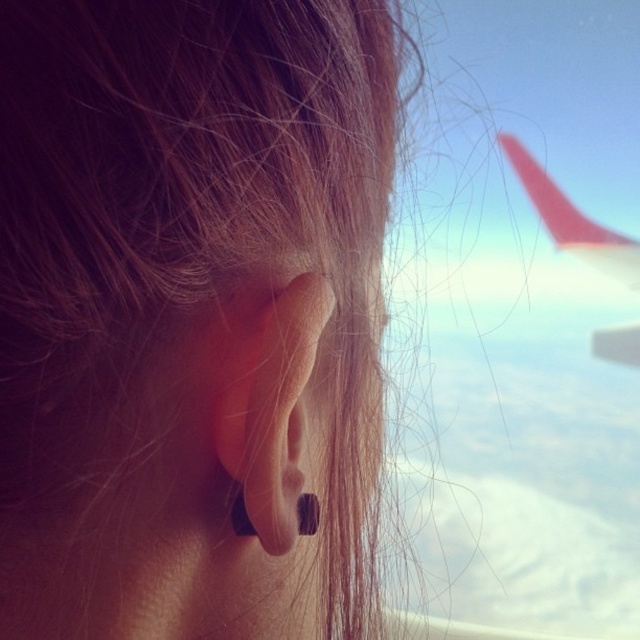
Question: Which of the following is the closest to the observer?

Choices:
 (A) coord(276,445)
 (B) coord(504,598)
 (C) coord(588,257)

Answer: (A)

Question: Is transparent glass airplane wing at upper right positioned at the back of black matte ear at center?

Choices:
 (A) yes
 (B) no

Answer: (A)

Question: Among these points, which one is farthest from the camera?

Choices:
 (A) (266, 476)
 (B) (308, 497)

Answer: (B)

Question: Is smooth red airplane wing at upper right further to camera compared to black matte earring at ear?

Choices:
 (A) yes
 (B) no

Answer: (A)

Question: Is transparent glass airplane wing at upper right further to the viewer compared to smooth red airplane wing at upper right?

Choices:
 (A) no
 (B) yes

Answer: (A)

Question: Which of these objects is positioned closest to the black matte earring at ear?

Choices:
 (A) smooth red airplane wing at upper right
 (B) black matte ear at center

Answer: (B)